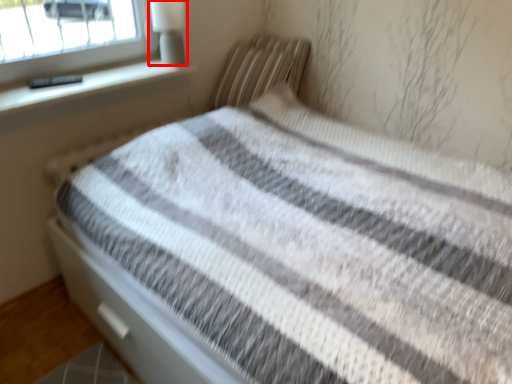
Question: Where is lamp (annotated by the red box) located in relation to pillow in the image?

Choices:
 (A) right
 (B) left

Answer: (B)